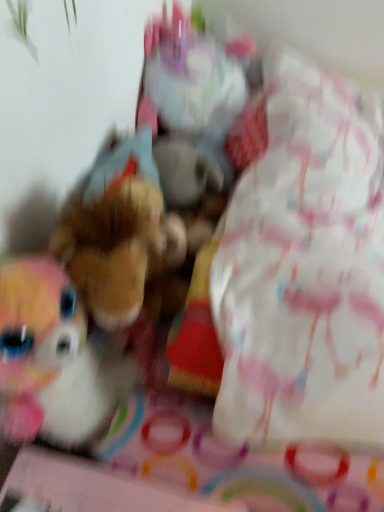
This screenshot has height=512, width=384. Describe the element at coordinates (117, 234) in the screenshot. I see `brown plush toy at center, which is the 1th toy in bottom-to-top order` at that location.

This screenshot has width=384, height=512. I want to click on brown plush toy at center, which is the 1th toy in bottom-to-top order, so click(x=117, y=234).

What do you see at coordinates (190, 104) in the screenshot?
I see `fluffy plush unicorn at upper center, which is counted as the first toy, starting from the top` at bounding box center [190, 104].

What is the approximate width of fluffy plush unicorn at upper center, which is counted as the first toy, starting from the top?

fluffy plush unicorn at upper center, which is counted as the first toy, starting from the top, is 10.27 inches in width.

The image size is (384, 512). I want to click on fluffy plush unicorn at upper center, placed as the second toy when sorted from bottom to top, so click(x=190, y=104).

Where is `brown plush toy at center, acting as the 2th toy starting from the top`? The height and width of the screenshot is (512, 384). brown plush toy at center, acting as the 2th toy starting from the top is located at coordinates [117, 234].

In the image, is brown plush toy at center, acting as the 2th toy starting from the top, on the left side or the right side of fluffy plush unicorn at upper center, which is counted as the first toy, starting from the top?

Clearly, brown plush toy at center, acting as the 2th toy starting from the top, is on the left of fluffy plush unicorn at upper center, which is counted as the first toy, starting from the top, in the image.

Is brown plush toy at center, which is the 1th toy in bottom-to-top order, positioned in front of fluffy plush unicorn at upper center, which is counted as the first toy, starting from the top?

That is True.

Does point (113, 272) come in front of point (200, 156)?

Yes, point (113, 272) is in front of point (200, 156).

From the image's perspective, is brown plush toy at center, acting as the 2th toy starting from the top, above or below fluffy plush unicorn at upper center, placed as the second toy when sorted from bottom to top?

brown plush toy at center, acting as the 2th toy starting from the top, is below fluffy plush unicorn at upper center, placed as the second toy when sorted from bottom to top.

From a real-world perspective, is brown plush toy at center, acting as the 2th toy starting from the top, above or below fluffy plush unicorn at upper center, placed as the second toy when sorted from bottom to top?

Clearly, from a real-world perspective, brown plush toy at center, acting as the 2th toy starting from the top, is below fluffy plush unicorn at upper center, placed as the second toy when sorted from bottom to top.

Which of these two, brown plush toy at center, which is the 1th toy in bottom-to-top order, or fluffy plush unicorn at upper center, placed as the second toy when sorted from bottom to top, is thinner?

With smaller width is brown plush toy at center, which is the 1th toy in bottom-to-top order.

Can you confirm if brown plush toy at center, acting as the 2th toy starting from the top, is shorter than fluffy plush unicorn at upper center, placed as the second toy when sorted from bottom to top?

Indeed, brown plush toy at center, acting as the 2th toy starting from the top, has a lesser height compared to fluffy plush unicorn at upper center, placed as the second toy when sorted from bottom to top.

Considering the relative sizes of brown plush toy at center, acting as the 2th toy starting from the top, and fluffy plush unicorn at upper center, which is counted as the first toy, starting from the top, in the image provided, is brown plush toy at center, acting as the 2th toy starting from the top, smaller than fluffy plush unicorn at upper center, which is counted as the first toy, starting from the top,?

Correct, brown plush toy at center, acting as the 2th toy starting from the top, occupies less space than fluffy plush unicorn at upper center, which is counted as the first toy, starting from the top.

Is brown plush toy at center, which is the 1th toy in bottom-to-top order, inside the boundaries of fluffy plush unicorn at upper center, placed as the second toy when sorted from bottom to top, or outside?

brown plush toy at center, which is the 1th toy in bottom-to-top order, is located beyond the bounds of fluffy plush unicorn at upper center, placed as the second toy when sorted from bottom to top.

Is brown plush toy at center, which is the 1th toy in bottom-to-top order, next to fluffy plush unicorn at upper center, placed as the second toy when sorted from bottom to top, and touching it?

No, brown plush toy at center, which is the 1th toy in bottom-to-top order, is not beside fluffy plush unicorn at upper center, placed as the second toy when sorted from bottom to top.

Is brown plush toy at center, acting as the 2th toy starting from the top, turned away from fluffy plush unicorn at upper center, which is counted as the first toy, starting from the top?

No, fluffy plush unicorn at upper center, which is counted as the first toy, starting from the top, is not at the back of brown plush toy at center, acting as the 2th toy starting from the top.

Measure the distance from brown plush toy at center, acting as the 2th toy starting from the top, to fluffy plush unicorn at upper center, which is counted as the first toy, starting from the top.

brown plush toy at center, acting as the 2th toy starting from the top, and fluffy plush unicorn at upper center, which is counted as the first toy, starting from the top, are 9.78 inches apart from each other.

Find the location of a particular element. toy above the brown plush toy at center, acting as the 2th toy starting from the top (from a real-world perspective) is located at coordinates (190, 104).

In the scene shown: Can you confirm if fluffy plush unicorn at upper center, which is counted as the first toy, starting from the top, is positioned to the left of brown plush toy at center, acting as the 2th toy starting from the top?

No.

Based on the photo, in the image, is fluffy plush unicorn at upper center, which is counted as the first toy, starting from the top, positioned in front of or behind brown plush toy at center, acting as the 2th toy starting from the top?

fluffy plush unicorn at upper center, which is counted as the first toy, starting from the top, is behind brown plush toy at center, acting as the 2th toy starting from the top.

Which point is more forward, [203,79] or [130,247]?

Positioned in front is point [130,247].

In the scene shown: From the image's perspective, is fluffy plush unicorn at upper center, which is counted as the first toy, starting from the top, below brown plush toy at center, which is the 1th toy in bottom-to-top order?

Actually, fluffy plush unicorn at upper center, which is counted as the first toy, starting from the top, appears above brown plush toy at center, which is the 1th toy in bottom-to-top order, in the image.

From the picture: From a real-world perspective, who is located higher, fluffy plush unicorn at upper center, which is counted as the first toy, starting from the top, or brown plush toy at center, acting as the 2th toy starting from the top?

fluffy plush unicorn at upper center, which is counted as the first toy, starting from the top, is physically above.

Does fluffy plush unicorn at upper center, placed as the second toy when sorted from bottom to top, have a greater width compared to brown plush toy at center, acting as the 2th toy starting from the top?

Yes.

Does fluffy plush unicorn at upper center, which is counted as the first toy, starting from the top, have a lesser height compared to brown plush toy at center, acting as the 2th toy starting from the top?

No, fluffy plush unicorn at upper center, which is counted as the first toy, starting from the top, is not shorter than brown plush toy at center, acting as the 2th toy starting from the top.

Between fluffy plush unicorn at upper center, which is counted as the first toy, starting from the top, and brown plush toy at center, which is the 1th toy in bottom-to-top order, which one has larger size?

Bigger between the two is fluffy plush unicorn at upper center, which is counted as the first toy, starting from the top.

Consider the image. Would you say fluffy plush unicorn at upper center, placed as the second toy when sorted from bottom to top, is inside or outside brown plush toy at center, which is the 1th toy in bottom-to-top order?

fluffy plush unicorn at upper center, placed as the second toy when sorted from bottom to top, is not inside brown plush toy at center, which is the 1th toy in bottom-to-top order, it's outside.

Is fluffy plush unicorn at upper center, which is counted as the first toy, starting from the top, far away from brown plush toy at center, acting as the 2th toy starting from the top?

No, fluffy plush unicorn at upper center, which is counted as the first toy, starting from the top, is not far away from brown plush toy at center, acting as the 2th toy starting from the top.

Is fluffy plush unicorn at upper center, which is counted as the first toy, starting from the top, oriented towards brown plush toy at center, acting as the 2th toy starting from the top?

No, fluffy plush unicorn at upper center, which is counted as the first toy, starting from the top, is not turned towards brown plush toy at center, acting as the 2th toy starting from the top.

How distant is fluffy plush unicorn at upper center, which is counted as the first toy, starting from the top, from brown plush toy at center, acting as the 2th toy starting from the top?

A distance of 24.85 centimeters exists between fluffy plush unicorn at upper center, which is counted as the first toy, starting from the top, and brown plush toy at center, acting as the 2th toy starting from the top.

This screenshot has width=384, height=512. I want to click on toy below the fluffy plush unicorn at upper center, placed as the second toy when sorted from bottom to top (from the image's perspective), so click(x=117, y=234).

Identify the location of toy behind the brown plush toy at center, which is the 1th toy in bottom-to-top order. (190, 104).

In the image, there is a fluffy plush unicorn at upper center, placed as the second toy when sorted from bottom to top. In order to click on toy below it (from the image's perspective) in this screenshot , I will do `click(117, 234)`.